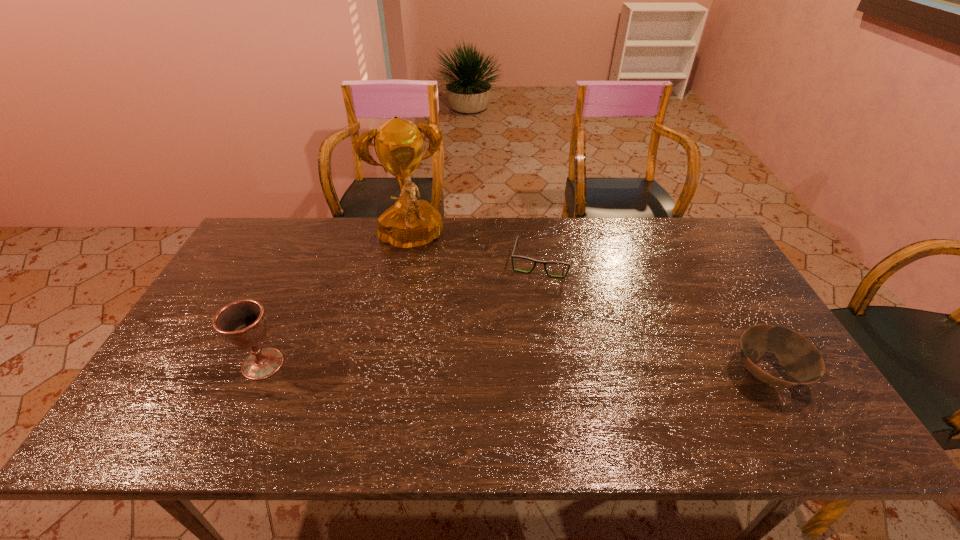
This screenshot has width=960, height=540. I want to click on object located in the right edge section of the desktop, so click(x=799, y=357).

What are the coordinates of `object that is positioned at the near right corner` in the screenshot? It's located at (799, 357).

The height and width of the screenshot is (540, 960). In the image, there is a desktop. Find the location of `blank space at the far edge`. blank space at the far edge is located at coordinates (627, 245).

This screenshot has width=960, height=540. Find the location of `vacant space at the right edge of the desktop`. vacant space at the right edge of the desktop is located at coordinates (735, 320).

You are a GUI agent. You are given a task and a screenshot of the screen. Output one action in this format:
    pyautogui.click(x=<x>, y=<y>)
    Task: Click on the vacant space at the far right corner of the desktop
    
    Given the screenshot: What is the action you would take?
    pyautogui.click(x=708, y=230)

Locate an element on the screen. unoccupied position between the award and the spectacles is located at coordinates (475, 253).

The height and width of the screenshot is (540, 960). I want to click on free space that is in between the chalice and the bowl, so click(x=515, y=369).

This screenshot has height=540, width=960. Identify the location of vacant space that's between the chalice and the tallest object. (336, 303).

Locate an element on the screen. This screenshot has width=960, height=540. free spot between the shortest object and the leftmost object is located at coordinates (402, 314).

You are a GUI agent. You are given a task and a screenshot of the screen. Output one action in this format:
    pyautogui.click(x=<x>, y=<y>)
    Task: Click on the unoccupied position between the leftmost object and the tallest object
    The width and height of the screenshot is (960, 540).
    Given the screenshot: What is the action you would take?
    pyautogui.click(x=336, y=303)